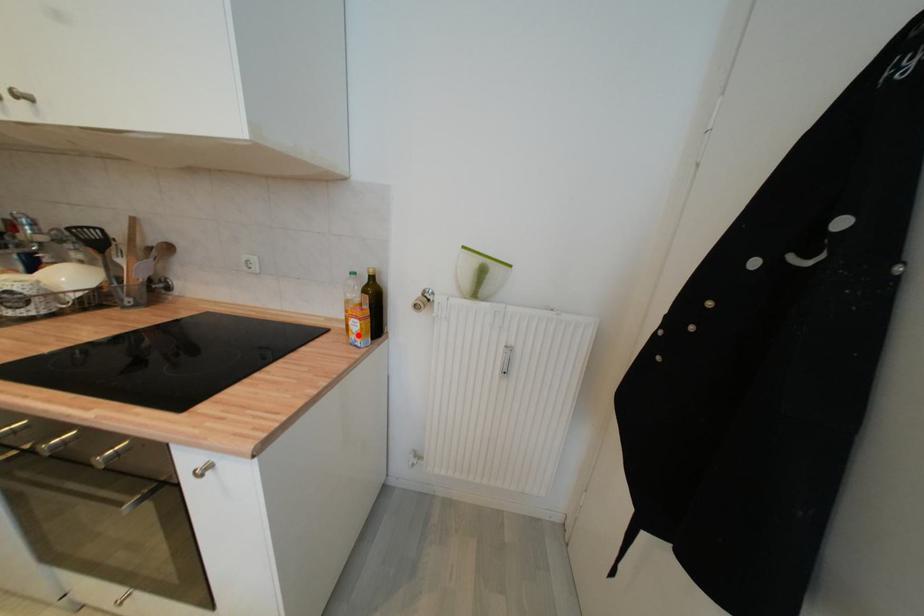
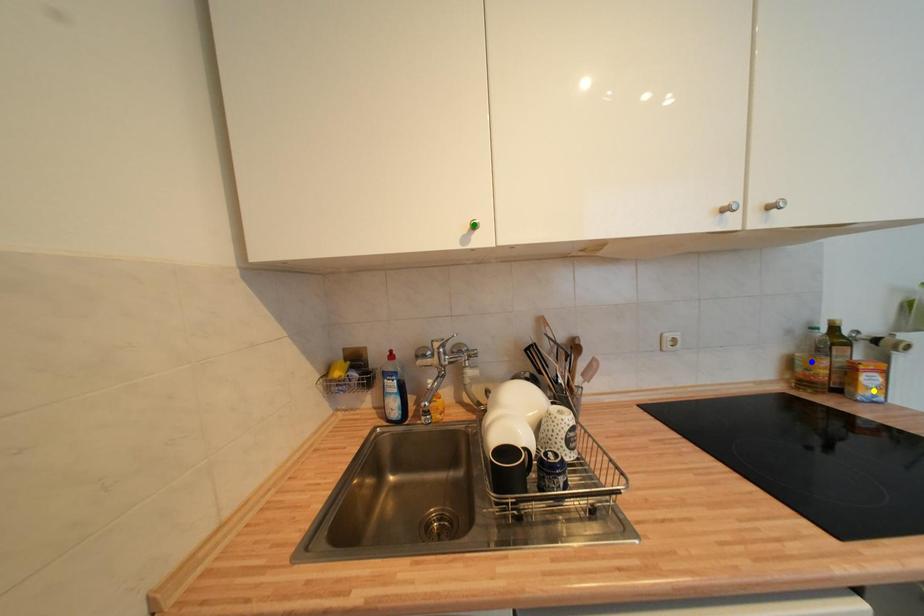
Question: I am providing you with two images of the same scene from different viewpoints. A red point is marked on the first image. You are given multiple points on the second image. Which point in image 2 represents the same 3d spot as the red point in image 1?

Choices:
 (A) yellow point
 (B) blue point
 (C) green point

Answer: (A)